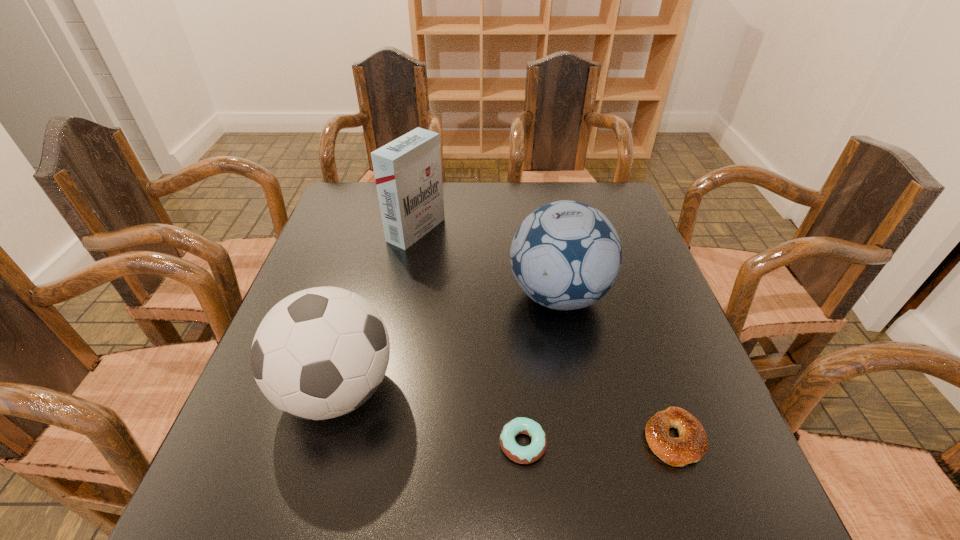
I want to click on free space located on the back of the left soccer ball, so click(x=373, y=262).

The image size is (960, 540). Identify the location of free spot located on the left of the fourth tallest object. click(589, 438).

Image resolution: width=960 pixels, height=540 pixels. What are the coordinates of `vacant space located 0.290m on the back of the shortest object` in the screenshot? It's located at (513, 312).

This screenshot has width=960, height=540. Identify the location of object that is positioned at the far edge. (408, 173).

Image resolution: width=960 pixels, height=540 pixels. Identify the location of object situated at the left edge. (320, 353).

Locate an element on the screen. This screenshot has height=540, width=960. soccer ball located in the right edge section of the desktop is located at coordinates (566, 255).

The image size is (960, 540). Identify the location of bagel that is at the right edge. (692, 443).

You are a GUI agent. You are given a task and a screenshot of the screen. Output one action in this format:
    pyautogui.click(x=<x>, y=<y>)
    Task: Click on the free space at the far edge of the desktop
    Image resolution: width=960 pixels, height=540 pixels.
    Given the screenshot: What is the action you would take?
    pyautogui.click(x=547, y=197)

The width and height of the screenshot is (960, 540). In the image, there is a desktop. Identify the location of free space at the near edge. coord(450,512).

The image size is (960, 540). Find the location of `vacant space at the right edge`. vacant space at the right edge is located at coordinates (635, 255).